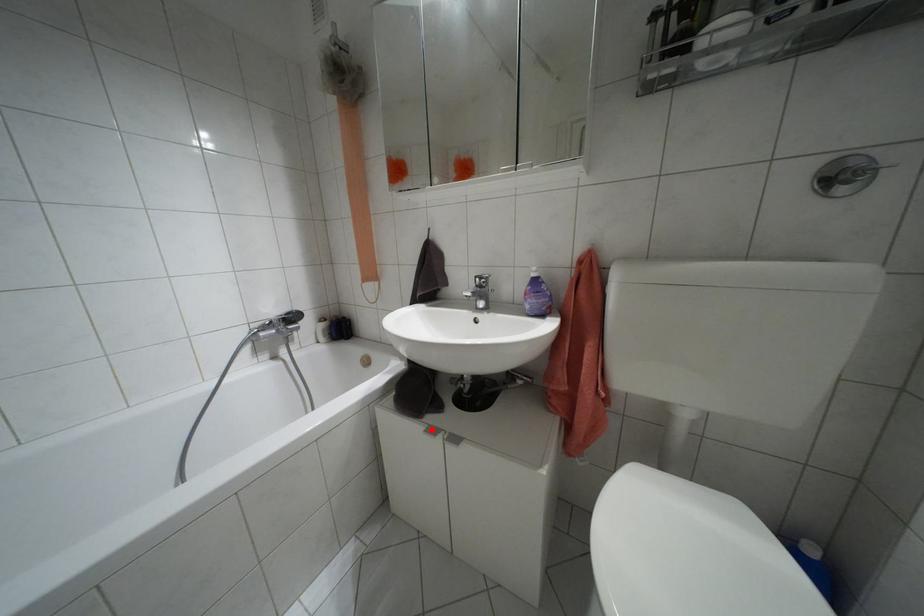
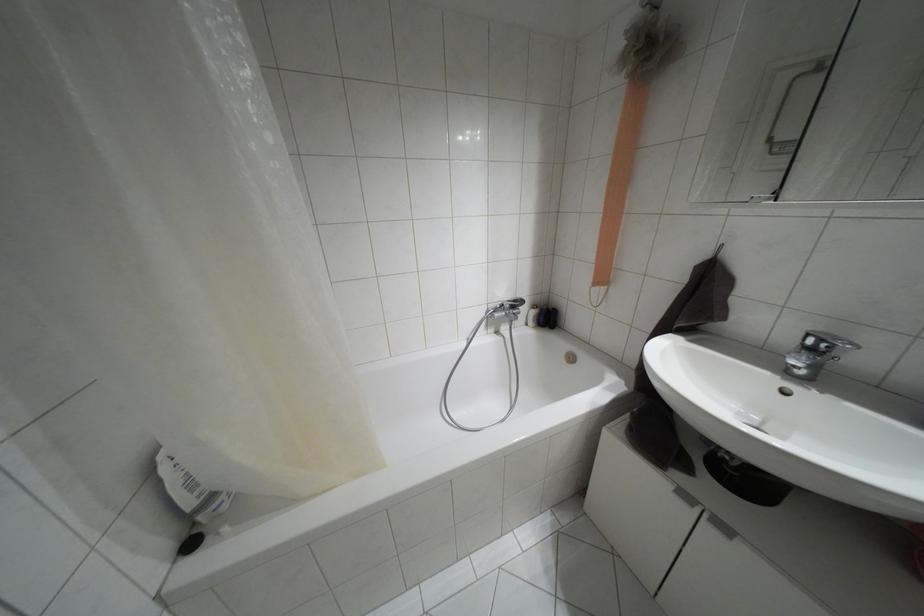
Find the pixel in the second image that matches the highlighted location in the first image.

(685, 496)